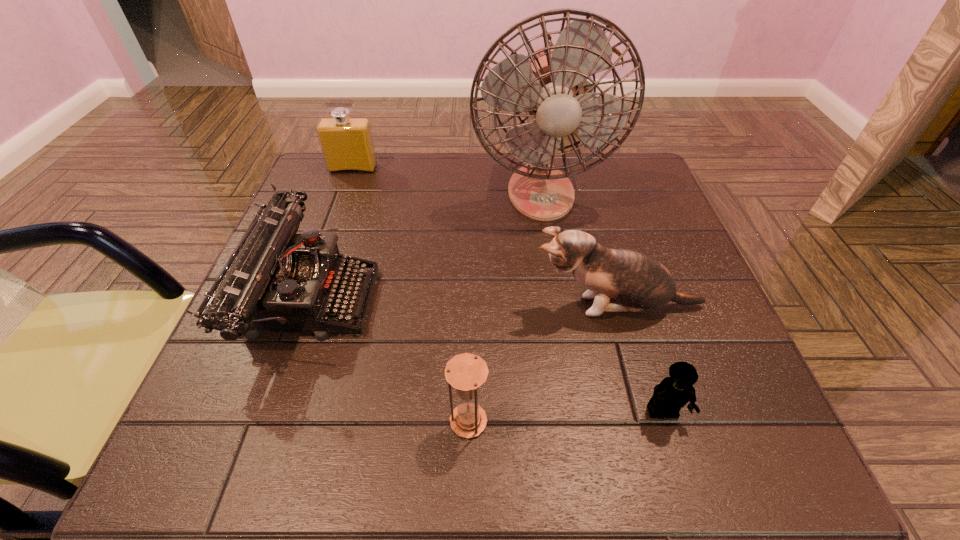
At what (x,y) coordinates should I click in order to perform the action: click on free space located at the face of the cat. Please return your answer as a coordinate pair (x, y). Image resolution: width=960 pixels, height=540 pixels. Looking at the image, I should click on (389, 306).

Image resolution: width=960 pixels, height=540 pixels. Identify the location of vacant point located on the keyboard of the typewriter. [x=503, y=298].

The width and height of the screenshot is (960, 540). Find the location of `free space located 0.270m on the right of the hourglass`. free space located 0.270m on the right of the hourglass is located at coordinates (663, 421).

Where is `fan at the far edge`? Image resolution: width=960 pixels, height=540 pixels. fan at the far edge is located at coordinates click(547, 83).

Identify the location of perfume located at the far edge. (347, 145).

Identify the location of hourglass located in the near edge section of the desktop. The height and width of the screenshot is (540, 960). (466, 372).

I want to click on Lego located at the near edge, so [x=673, y=392].

This screenshot has height=540, width=960. Identify the location of perfume located at the left edge. coord(347,145).

At what (x,y) coordinates should I click in order to perform the action: click on typewriter present at the left edge. Please return your answer as a coordinate pair (x, y). This screenshot has height=540, width=960. Looking at the image, I should click on (278, 281).

You are a GUI agent. You are given a task and a screenshot of the screen. Output one action in this format:
    pyautogui.click(x=<x>, y=<y>)
    Task: Click on the fan that is at the right edge
    The width and height of the screenshot is (960, 540).
    Given the screenshot: What is the action you would take?
    pyautogui.click(x=547, y=83)